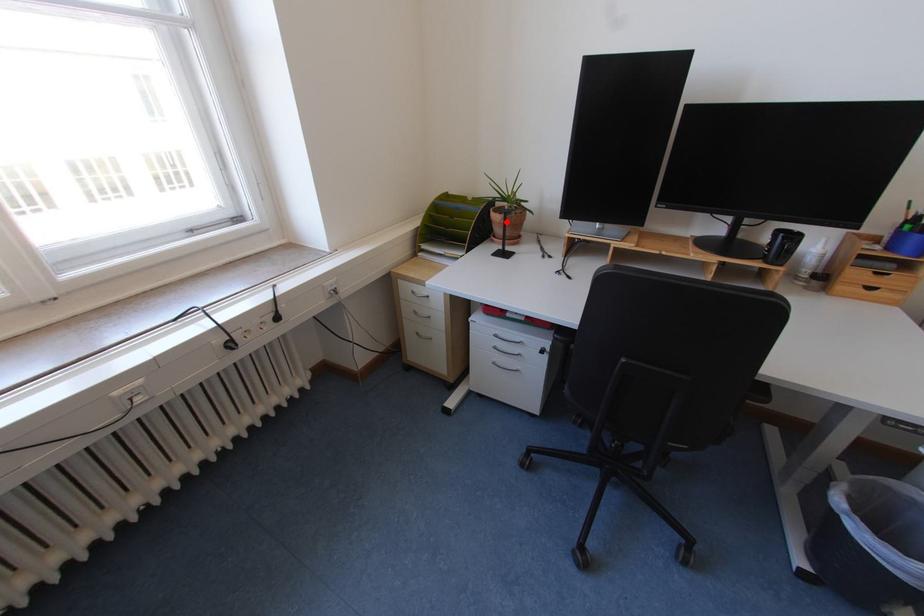
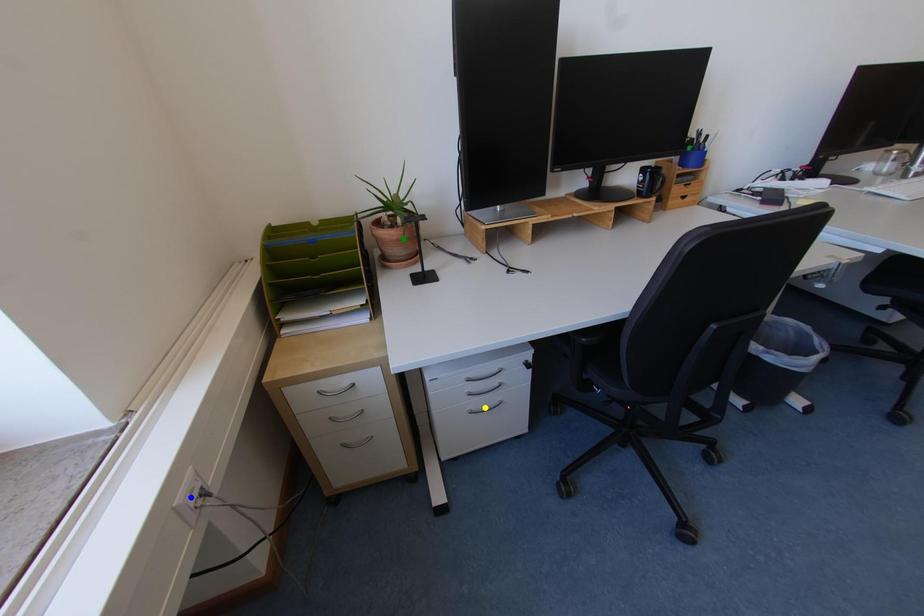
Question: I am providing you with two images of the same scene from different viewpoints. A red point is marked on the first image. You are given multiple points on the second image. Which mark in image 2 goes with the point in image 1?

Choices:
 (A) blue point
 (B) green point
 (C) yellow point

Answer: (B)